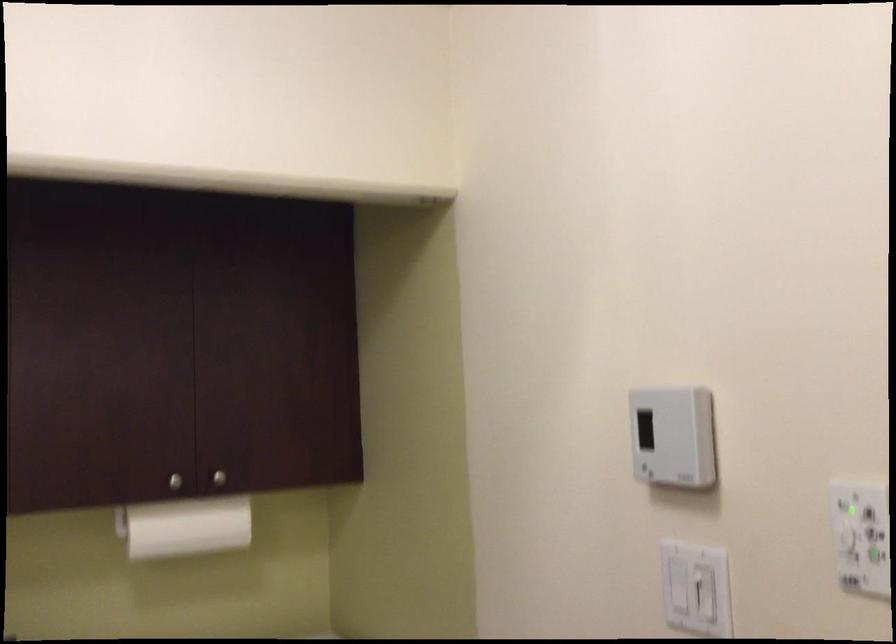
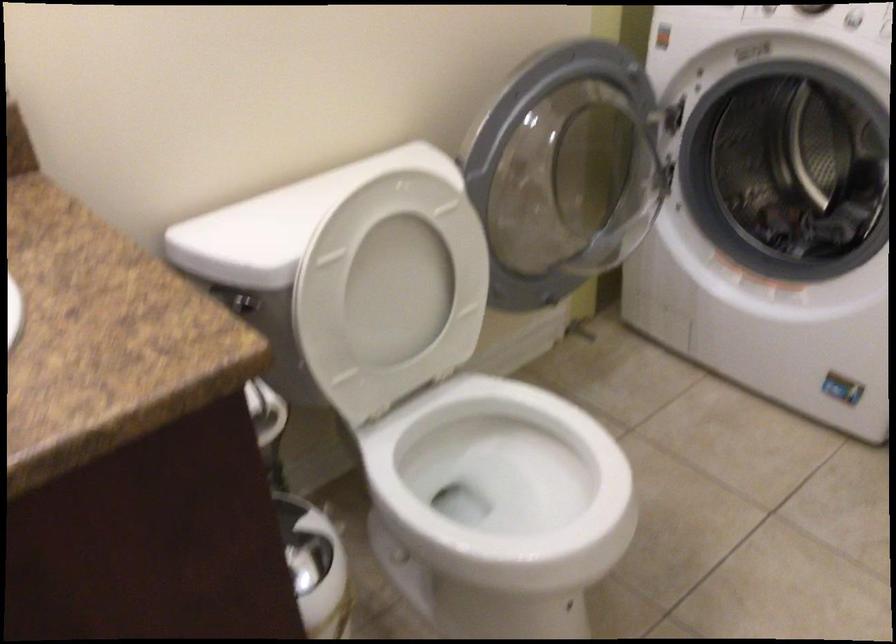
The images are taken continuously from a first-person perspective. In which direction is your viewpoint rotating?

The camera rotated toward left-down.